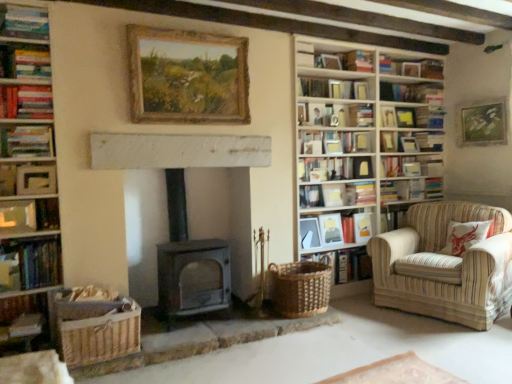
Question: From the image's perspective, relative to matte white frame at upper right, marked as the 11th book in a top-to-bottom arrangement, is wooden-framed painting at upper center, which is the 5th picture frame from right to left, above or below?

Choices:
 (A) above
 (B) below

Answer: (A)

Question: Is wooden-framed painting at upper center, which appears as the 1th picture frame when viewed from the top, bigger or smaller than matte white frame at upper right, marked as the 11th book in a top-to-bottom arrangement?

Choices:
 (A) big
 (B) small

Answer: (A)

Question: Estimate the real-world distances between objects in this image. Which object is farther from the hardcover book at left, the tenth book viewed from the top?

Choices:
 (A) matte wooden picture frame at center-right, which appears as the 4th picture frame when viewed from the left
 (B) matte white frame at upper left, which is counted as the 6th book, starting from the bottom
 (C) wooden bookshelf at right
 (D) hardcover book at upper right, which is counted as the 12th book, starting from the bottom
 (E) hardcover book at center, which ranks as the 9th book in bottom-to-top order

Answer: (A)

Question: Estimate the real-world distances between objects in this image. Which object is closer to the matte silver picture frame at center, the 2th picture frame from the front?

Choices:
 (A) matte blue book at upper left, which ranks as the 1th book in top-to-bottom order
 (B) striped fabric armchair at right
 (C) wooden-framed painting at upper center, the first picture frame from the front
 (D) matte white frame at upper right, marked as the 11th book in a top-to-bottom arrangement
 (E) hardcover book at left, the tenth book viewed from the top

Answer: (D)